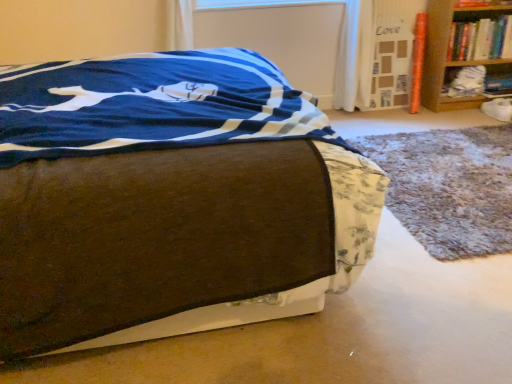
You are a GUI agent. You are given a task and a screenshot of the screen. Output one action in this format:
    pyautogui.click(x=<x>, y=<y>)
    Task: Click on the transparent plastic window screen at upper center
    The image size is (512, 384).
    Given the screenshot: What is the action you would take?
    pyautogui.click(x=255, y=3)

I want to click on wooden bookshelf at upper right, marked as the 2th shelf in a left-to-right arrangement, so click(463, 48).

Measure the distance between brown fabric bed at center and camera.

A distance of 38.46 inches exists between brown fabric bed at center and camera.

At what (x,y) coordinates should I click in order to perform the action: click on fluffy gray rug at lower right. Please return your answer as a coordinate pair (x, y). The width and height of the screenshot is (512, 384). Looking at the image, I should click on (449, 187).

Describe the element at coordinates (476, 82) in the screenshot. Image resolution: width=512 pixels, height=384 pixels. I see `white fabric at right, marked as the first shelf in a left-to-right arrangement` at that location.

Where is `transparent plastic window screen at upper center`? The height and width of the screenshot is (384, 512). transparent plastic window screen at upper center is located at coordinates (255, 3).

Between hardcover book at upper right and fluffy gray rug at lower right, which one has larger size?

With larger size is fluffy gray rug at lower right.

Considering the relative sizes of hardcover book at upper right and fluffy gray rug at lower right in the image provided, is hardcover book at upper right shorter than fluffy gray rug at lower right?

No.

Find the location of a particular element. book that appears above the fluffy gray rug at lower right (from a real-world perspective) is located at coordinates (481, 39).

Consider the image. In the image, is hardcover book at upper right positioned in front of or behind fluffy gray rug at lower right?

Clearly, hardcover book at upper right is behind fluffy gray rug at lower right.

Considering the sizes of objects wooden bookshelf at upper right, marked as the 2th shelf in a left-to-right arrangement, and hardcover book at upper right in the image provided, who is taller, wooden bookshelf at upper right, marked as the 2th shelf in a left-to-right arrangement, or hardcover book at upper right?

wooden bookshelf at upper right, marked as the 2th shelf in a left-to-right arrangement, is taller.

Does wooden bookshelf at upper right, marked as the 2th shelf in a left-to-right arrangement, have a smaller size compared to hardcover book at upper right?

No.

From a real-world perspective, between wooden bookshelf at upper right, marked as the 2th shelf in a left-to-right arrangement, and hardcover book at upper right, who is vertically lower?

wooden bookshelf at upper right, marked as the 2th shelf in a left-to-right arrangement, is physically lower.

Find the location of a particular element. Image resolution: width=512 pixels, height=384 pixels. book above the brown fabric bed at center (from a real-world perspective) is located at coordinates (481, 39).

Is hardcover book at upper right positioned with its back to brown fabric bed at center?

No, hardcover book at upper right is not facing the opposite direction of brown fabric bed at center.

Is there a large distance between hardcover book at upper right and brown fabric bed at center?

Yes, hardcover book at upper right is far from brown fabric bed at center.

Is point (501, 54) closer or farther from the camera than point (58, 155)?

Point (501, 54) is farther from the camera than point (58, 155).

Is brown fabric bed at center completely or partially outside of transparent plastic window screen at upper center?

Absolutely, brown fabric bed at center is external to transparent plastic window screen at upper center.

From their relative heights in the image, would you say brown fabric bed at center is taller or shorter than transparent plastic window screen at upper center?

brown fabric bed at center is taller than transparent plastic window screen at upper center.

Which point is more distant from viewer, [63,282] or [281,1]?

The point [281,1] is farther.

Which object is wider, brown fabric bed at center or transparent plastic window screen at upper center?

brown fabric bed at center is wider.

Which is closer to the camera, [430,151] or [486,73]?

Point [430,151].

Is fluffy gray rug at lower right looking in the opposite direction of white fabric at right, which is counted as the second shelf, starting from the right?

fluffy gray rug at lower right is not turned away from white fabric at right, which is counted as the second shelf, starting from the right.

Is fluffy gray rug at lower right positioned beyond the bounds of white fabric at right, marked as the first shelf in a left-to-right arrangement?

Yes, fluffy gray rug at lower right is outside of white fabric at right, marked as the first shelf in a left-to-right arrangement.

In the image, is fluffy gray rug at lower right on the left side or the right side of white fabric at right, marked as the first shelf in a left-to-right arrangement?

fluffy gray rug at lower right is to the left of white fabric at right, marked as the first shelf in a left-to-right arrangement.

Which object is wider, transparent plastic window screen at upper center or brown fabric bed at center?

brown fabric bed at center is wider.

Who is smaller, transparent plastic window screen at upper center or brown fabric bed at center?

transparent plastic window screen at upper center.

Is transparent plastic window screen at upper center placed right next to brown fabric bed at center?

They are not placed beside each other.

Consider the image. Does hardcover book at upper right have a greater width compared to wooden bookshelf at upper right, the first shelf positioned from the right?

No, hardcover book at upper right is not wider than wooden bookshelf at upper right, the first shelf positioned from the right.

The image size is (512, 384). In order to click on book above the wooden bookshelf at upper right, marked as the 2th shelf in a left-to-right arrangement (from a real-world perspective) in this screenshot , I will do [481, 39].

What's the angular difference between hardcover book at upper right and wooden bookshelf at upper right, marked as the 2th shelf in a left-to-right arrangement,'s facing directions?

hardcover book at upper right and wooden bookshelf at upper right, marked as the 2th shelf in a left-to-right arrangement, are facing 2.69 degrees away from each other.

In the image, is hardcover book at upper right on the left side or the right side of wooden bookshelf at upper right, the first shelf positioned from the right?

In the image, hardcover book at upper right appears on the left side of wooden bookshelf at upper right, the first shelf positioned from the right.

Identify the location of book above the fluffy gray rug at lower right (from the image's perspective). (481, 39).

Find the location of `book above the wooden bookshelf at upper right, the first shelf positioned from the right (from a real-world perspective)`. book above the wooden bookshelf at upper right, the first shelf positioned from the right (from a real-world perspective) is located at coordinates (481, 39).

Which object lies nearer to the anchor point transparent plastic window screen at upper center, brown fabric bed at center or wooden bookshelf at upper right, the first shelf positioned from the right?

The object closer to transparent plastic window screen at upper center is wooden bookshelf at upper right, the first shelf positioned from the right.

Estimate the real-world distances between objects in this image. Which object is closer to wooden bookshelf at upper right, marked as the 2th shelf in a left-to-right arrangement, white fabric at right, marked as the first shelf in a left-to-right arrangement, or fluffy gray rug at lower right?

white fabric at right, marked as the first shelf in a left-to-right arrangement, is closer to wooden bookshelf at upper right, marked as the 2th shelf in a left-to-right arrangement.

Looking at this image, based on their spatial positions, is white fabric at right, marked as the first shelf in a left-to-right arrangement, or wooden bookshelf at upper right, the first shelf positioned from the right, further from transparent plastic window screen at upper center?

white fabric at right, marked as the first shelf in a left-to-right arrangement, is positioned further to the anchor transparent plastic window screen at upper center.

When comparing their distances from white fabric at right, which is counted as the second shelf, starting from the right, does hardcover book at upper right or wooden bookshelf at upper right, the first shelf positioned from the right, seem further?

Based on the image, hardcover book at upper right appears to be further to white fabric at right, which is counted as the second shelf, starting from the right.

In the scene shown: When comparing their distances from transparent plastic window screen at upper center, does white fabric at right, which is counted as the second shelf, starting from the right, or fluffy gray rug at lower right seem closer?

Based on the image, white fabric at right, which is counted as the second shelf, starting from the right, appears to be nearer to transparent plastic window screen at upper center.

Looking at the image, which one is located further to transparent plastic window screen at upper center, fluffy gray rug at lower right or wooden bookshelf at upper right, the first shelf positioned from the right?

fluffy gray rug at lower right.

From the image, which object appears to be farther from transparent plastic window screen at upper center, hardcover book at upper right or brown fabric bed at center?

Based on the image, brown fabric bed at center appears to be further to transparent plastic window screen at upper center.

Based on their spatial positions, is hardcover book at upper right or fluffy gray rug at lower right further from brown fabric bed at center?

hardcover book at upper right is further to brown fabric bed at center.

Where is `window screen between brown fabric bed at center and hardcover book at upper right along the z-axis`? window screen between brown fabric bed at center and hardcover book at upper right along the z-axis is located at coordinates (255, 3).

The height and width of the screenshot is (384, 512). Find the location of `cat bed positioned between brown fabric bed at center and white fabric at right, marked as the first shelf in a left-to-right arrangement, from near to far`. cat bed positioned between brown fabric bed at center and white fabric at right, marked as the first shelf in a left-to-right arrangement, from near to far is located at coordinates (449, 187).

In order to click on cat bed between brown fabric bed at center and hardcover book at upper right from left to right in this screenshot , I will do `click(449, 187)`.

You are a GUI agent. You are given a task and a screenshot of the screen. Output one action in this format:
    pyautogui.click(x=<x>, y=<y>)
    Task: Click on the cat bed located between brown fabric bed at center and transparent plastic window screen at upper center in the depth direction
    This screenshot has height=384, width=512.
    Given the screenshot: What is the action you would take?
    pyautogui.click(x=449, y=187)